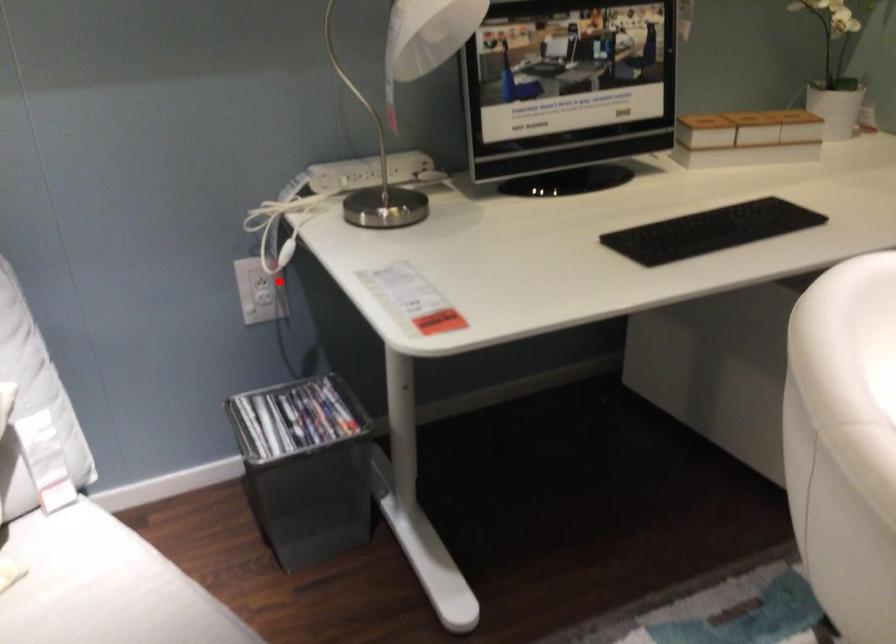
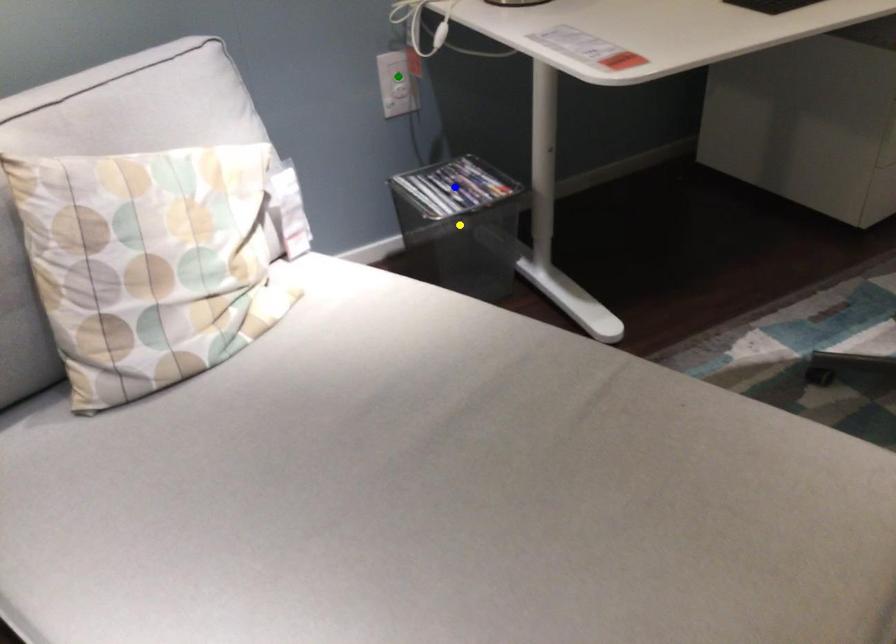
Question: I am providing you with two images of the same scene from different viewpoints. A red point is marked on the first image. You are given multiple points on the second image. Which mark in image 2 goes with the point in image 1?

Choices:
 (A) blue point
 (B) yellow point
 (C) green point

Answer: (C)